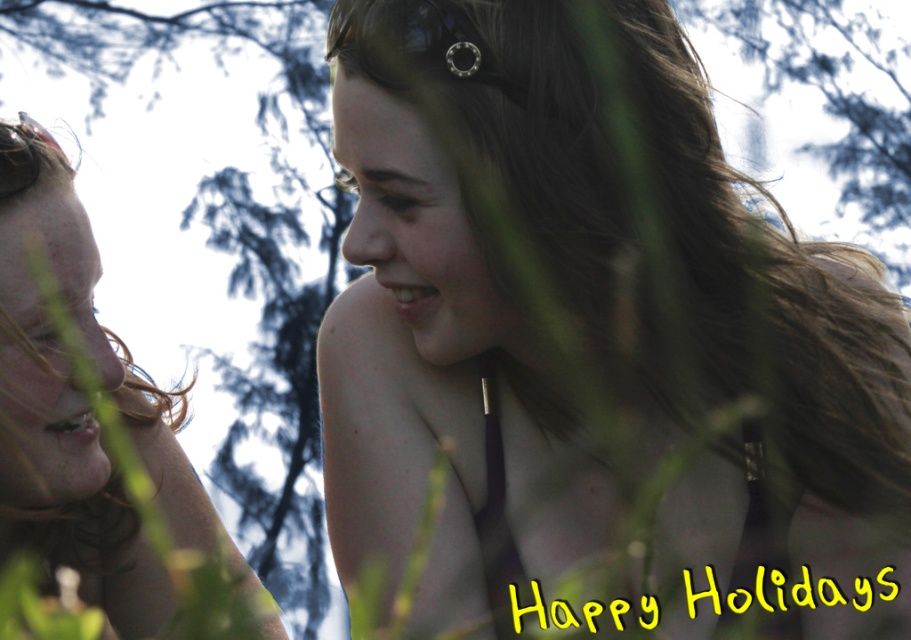
Question: Among these points, which one is farthest from the camera?

Choices:
 (A) (759, 472)
 (B) (874, 612)
 (C) (23, 182)
 (D) (213, 528)

Answer: (D)

Question: In this image, where is matte skin tone face at left located relative to matte purple bikini top at center?

Choices:
 (A) below
 (B) above

Answer: (B)

Question: Which object is positioned farthest from the smooth brown hair at center?

Choices:
 (A) matte skin tone face at left
 (B) matte purple bikini top at center
 (C) shiny metallic goggles at upper left

Answer: (C)

Question: Does matte skin tone face at left appear on the right side of matte purple bikini top at center?

Choices:
 (A) yes
 (B) no

Answer: (B)

Question: Which point is closer to the camera taking this photo?

Choices:
 (A) (365, 483)
 (B) (1, 152)
 (C) (493, 381)

Answer: (B)

Question: Can you confirm if matte skin tone face at left is positioned to the right of shiny metallic goggles at upper left?

Choices:
 (A) yes
 (B) no

Answer: (A)